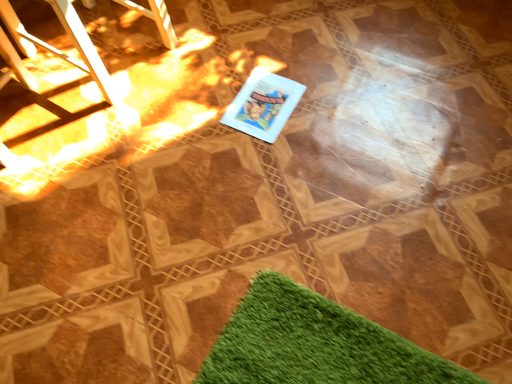
Image resolution: width=512 pixels, height=384 pixels. What do you see at coordinates (55, 55) in the screenshot? I see `metallic white chair at upper left` at bounding box center [55, 55].

In the scene shown: What is the approximate width of metallic white chair at upper left?

It is 20.79 inches.

The height and width of the screenshot is (384, 512). I want to click on metallic white chair at upper left, so click(x=55, y=55).

Where is `metallic white chair at upper left`? The width and height of the screenshot is (512, 384). metallic white chair at upper left is located at coordinates (55, 55).